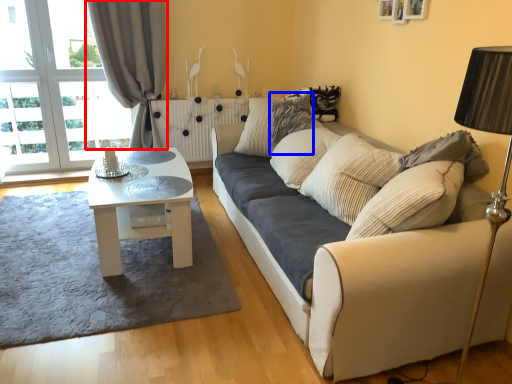
Question: Which object appears farthest to the camera in this image, curtain (highlighted by a red box) or pillow (highlighted by a blue box)?

Choices:
 (A) curtain
 (B) pillow

Answer: (A)